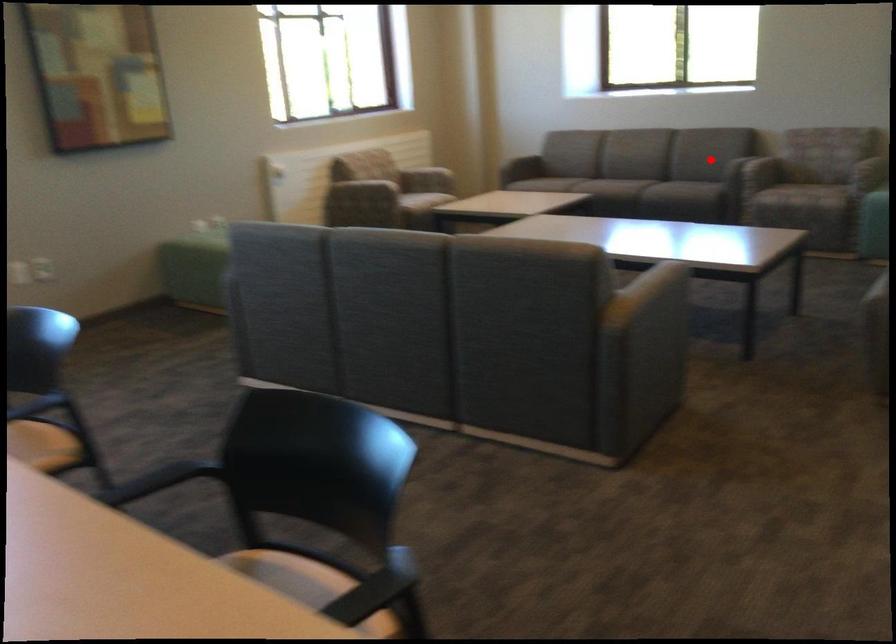
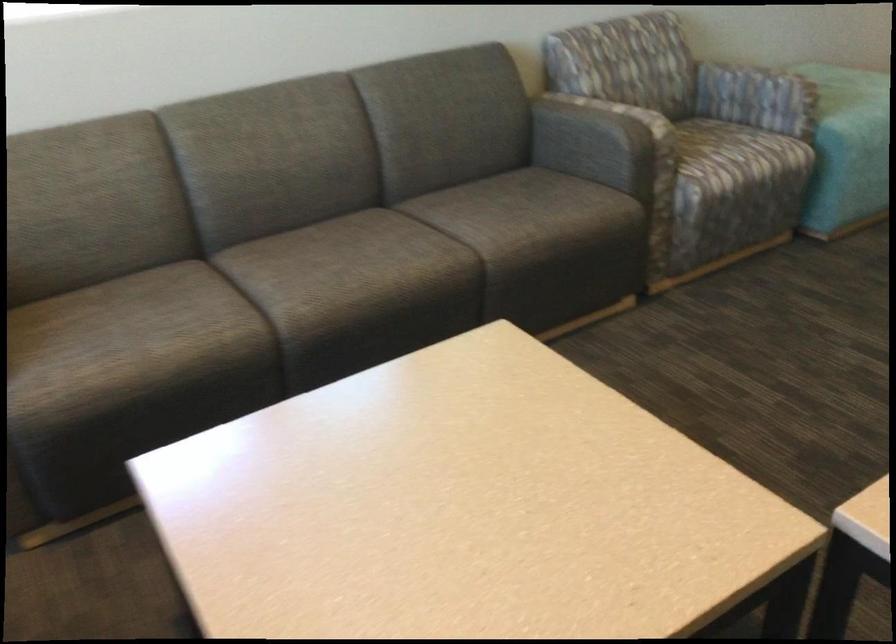
Question: A red point is marked in image1. In image2, is the corresponding 3D point closer to the camera or farther? Reply with the corresponding letter.

Choices:
 (A) The corresponding 3D point is closer.
 (B) The corresponding 3D point is farther.

Answer: (A)